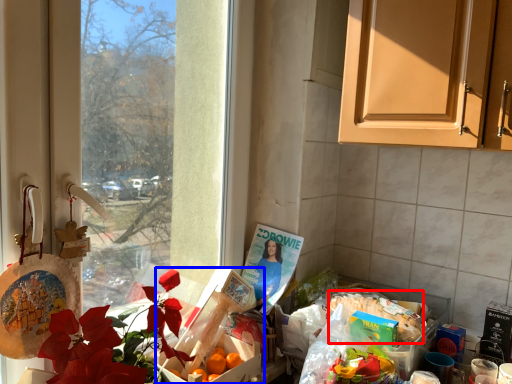
Question: Which object appears closest to the camera in this image, food (highlighted by a red box) or box (highlighted by a blue box)?

Choices:
 (A) food
 (B) box

Answer: (B)